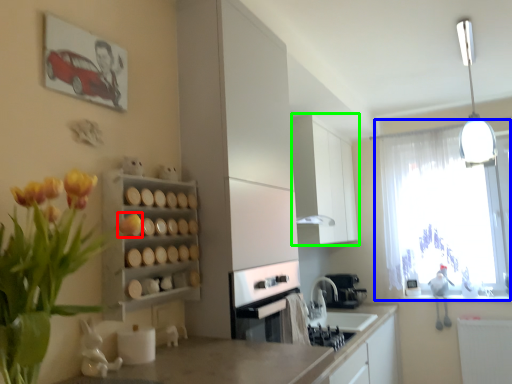
Question: Based on their relative distances, which object is nearer to flower (highlighted by a red box)? Choose from window (highlighted by a blue box) and cabinetry (highlighted by a green box).

Choices:
 (A) window
 (B) cabinetry

Answer: (B)